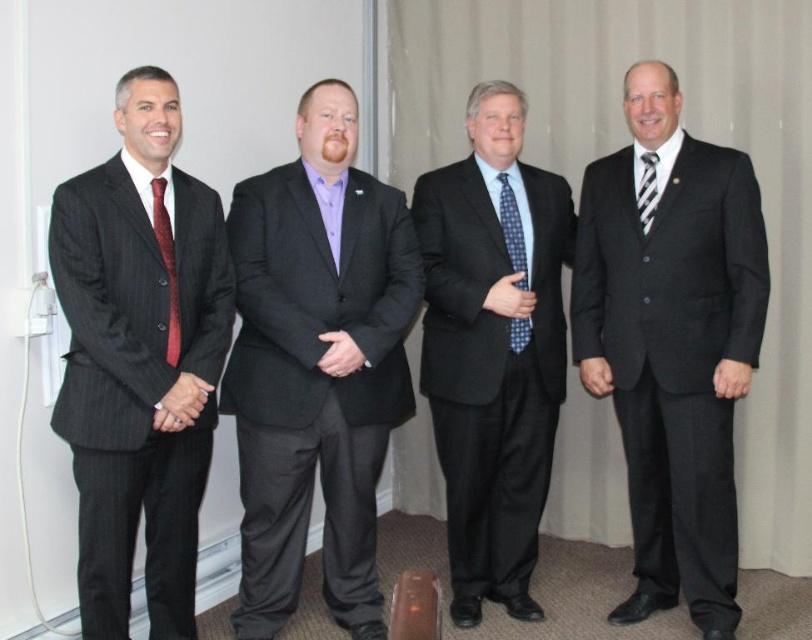
Question: Does matte black suit at right have a smaller size compared to polka dot tie at center?

Choices:
 (A) no
 (B) yes

Answer: (A)

Question: Which of these objects is positioned closest to the matte black suit at right?

Choices:
 (A) striped silk tie at right
 (B) polka dot tie at center
 (C) matte red tie at left
 (D) blue dotted tie at center

Answer: (B)

Question: Does pinstripe suit at left have a larger size compared to matte red tie at left?

Choices:
 (A) yes
 (B) no

Answer: (A)

Question: Can you confirm if matte black suit at right is wider than matte red tie at left?

Choices:
 (A) yes
 (B) no

Answer: (A)

Question: Estimate the real-world distances between objects in this image. Which object is closer to the matte black suit at right?

Choices:
 (A) matte red tie at left
 (B) blue dotted tie at center
 (C) pinstripe suit at left

Answer: (B)

Question: Which of the following is the farthest from the observer?

Choices:
 (A) striped silk tie at right
 (B) blue dotted tie at center
 (C) pinstripe suit at left

Answer: (B)